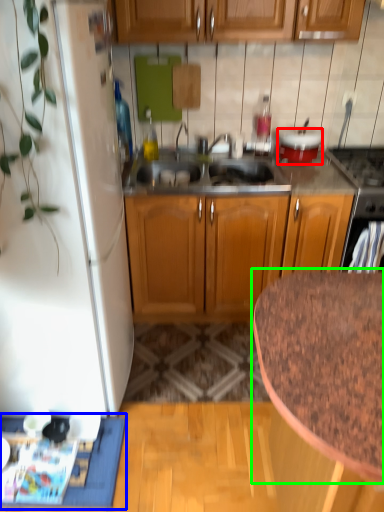
Question: Estimate the real-world distances between objects in this image. Which object is farther from appliance (highlighted by a red box), doormat (highlighted by a blue box) or countertop (highlighted by a green box)?

Choices:
 (A) doormat
 (B) countertop

Answer: (A)